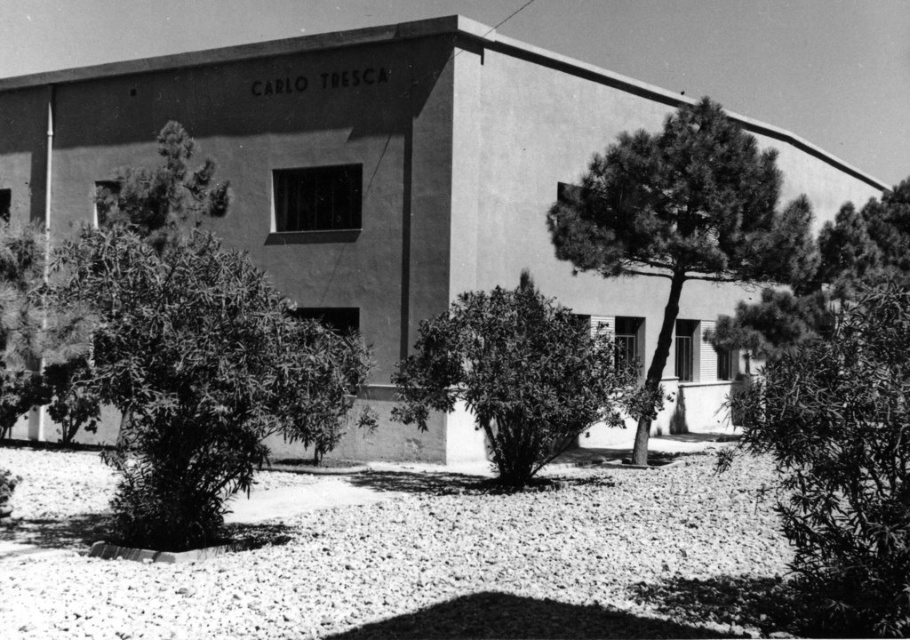
Question: Considering the relative positions of smooth green tree at center and green leafy tree at upper left in the image provided, where is smooth green tree at center located with respect to green leafy tree at upper left?

Choices:
 (A) below
 (B) above

Answer: (B)

Question: Does green leafy bush at center appear on the right side of green leafy tree at upper left?

Choices:
 (A) yes
 (B) no

Answer: (A)

Question: Which object is closer to the camera taking this photo?

Choices:
 (A) green leafy tree at upper left
 (B) thick green foliage at center
 (C) smooth green leaves at right
 (D) smooth green tree at center

Answer: (C)

Question: Among these points, which one is nearest to the camera?

Choices:
 (A) (447, 364)
 (B) (721, 122)
 (C) (251, 320)
 (D) (104, 188)

Answer: (C)

Question: Does smooth green leaves at right appear over smooth green tree at center?

Choices:
 (A) yes
 (B) no

Answer: (B)

Question: Which of the following is the farthest from the observer?

Choices:
 (A) green leafy bush at center
 (B) smooth green leaves at right
 (C) thick green foliage at center
 (D) smooth green tree at center

Answer: (D)